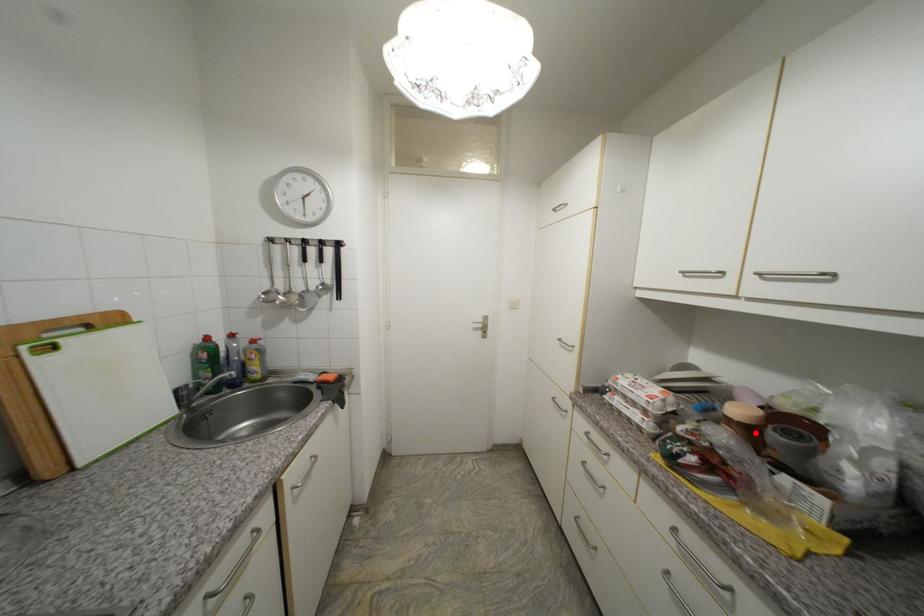
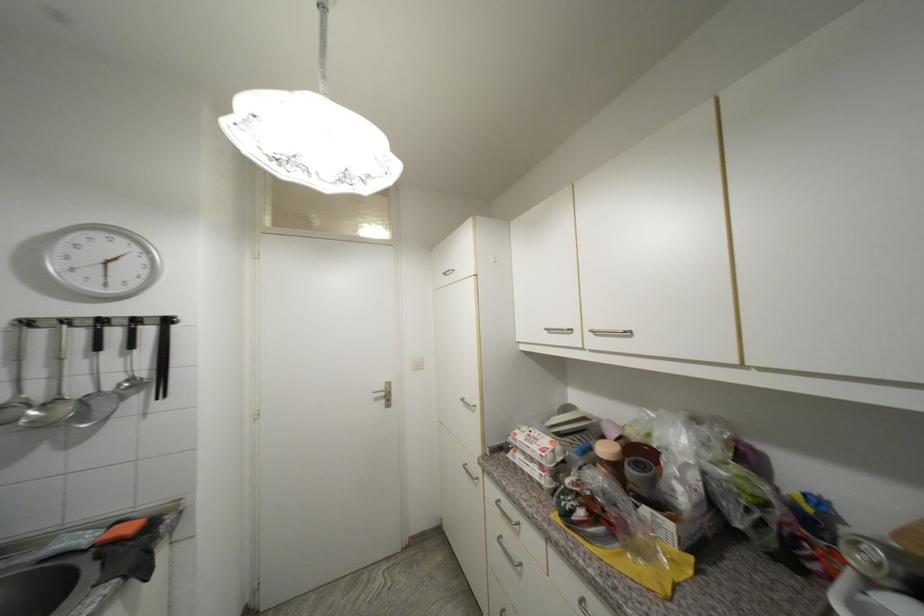
Question: I am providing you with two images of the same scene from different viewpoints. A red point is marked on the first image. Can you still see the location of the red point in image 2?

Choices:
 (A) Yes
 (B) No

Answer: (A)